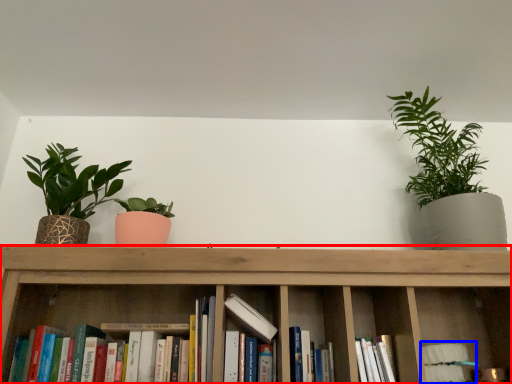
Question: Which object appears farthest to the camera in this image, shelf (highlighted by a red box) or book (highlighted by a blue box)?

Choices:
 (A) shelf
 (B) book

Answer: (B)